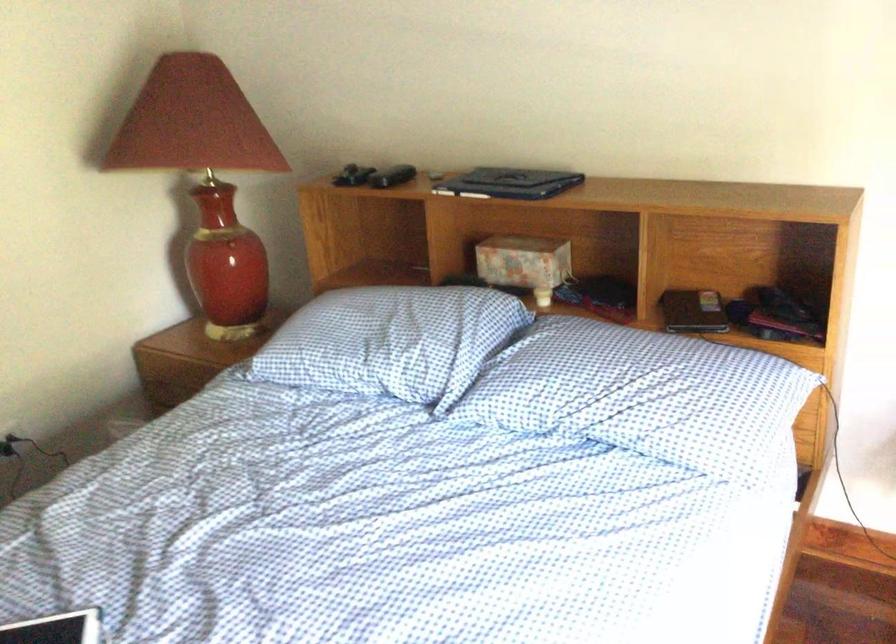
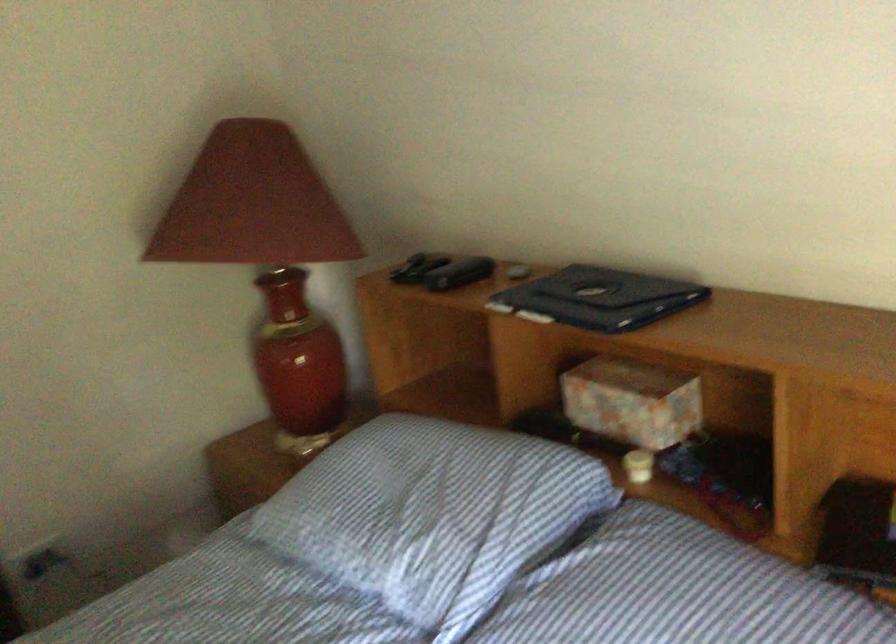
Question: Based on the continuous images, in which direction is the camera rotating? Reply with the corresponding letter.

Choices:
 (A) Left
 (B) Right
 (C) Up
 (D) Down

Answer: (A)